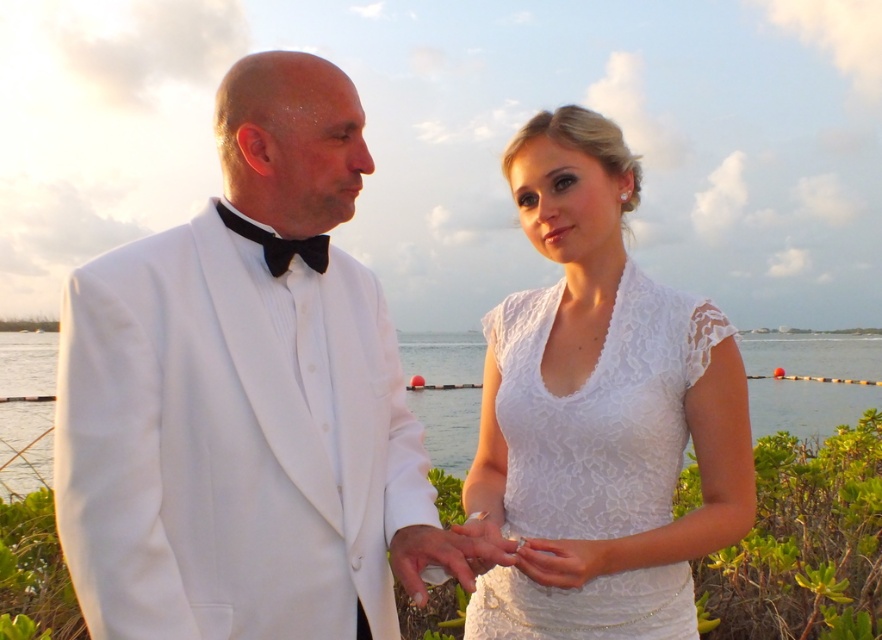
Question: Which object is closer to the camera taking this photo?

Choices:
 (A) clear water at center
 (B) white satin tuxedo at left

Answer: (B)

Question: Is lace fabric dress at center further to camera compared to clear water at center?

Choices:
 (A) no
 (B) yes

Answer: (B)

Question: Which of the following is the farthest from the observer?

Choices:
 (A) clear water at center
 (B) lace fabric dress at center

Answer: (B)

Question: Can you confirm if white satin tuxedo at left is positioned above lace fabric dress at center?

Choices:
 (A) yes
 (B) no

Answer: (A)

Question: Where is white satin tuxedo at left located in relation to lace fabric dress at center in the image?

Choices:
 (A) left
 (B) right

Answer: (A)

Question: Which point is farther to the camera?

Choices:
 (A) (832, 368)
 (B) (469, 500)

Answer: (A)